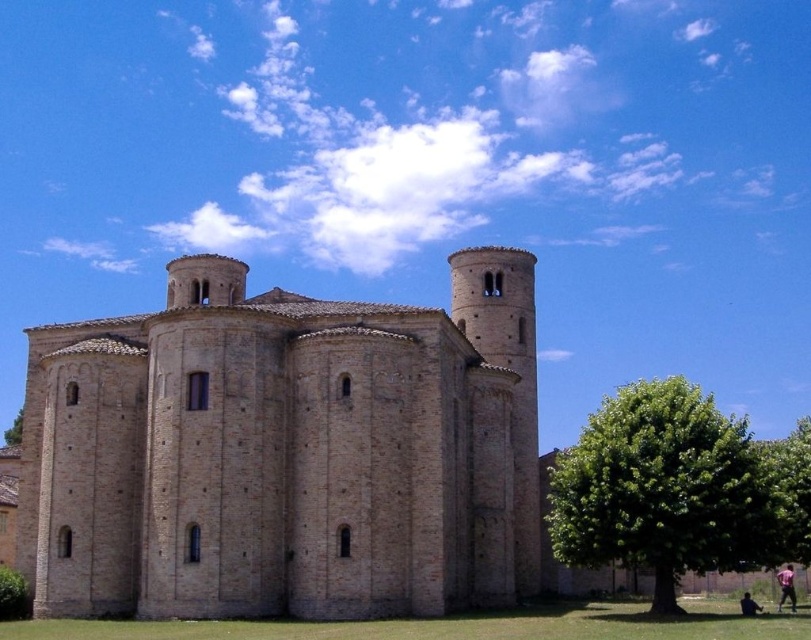
Question: Is beige stone church at center to the left of green leafy tree at lower right from the viewer's perspective?

Choices:
 (A) no
 (B) yes

Answer: (B)

Question: Which point appears farthest from the camera in this image?

Choices:
 (A) (792, 596)
 (B) (11, 433)

Answer: (B)

Question: Among these points, which one is farthest from the camera?

Choices:
 (A) (792, 589)
 (B) (747, 608)
 (C) (792, 547)

Answer: (A)

Question: Can you confirm if green leafy tree at lower right is positioned above green leafy tree at lower left?

Choices:
 (A) no
 (B) yes

Answer: (B)

Question: Which object is the closest to the green leafy tree at lower right?

Choices:
 (A) green leafy tree at lower left
 (B) pink fabric pants at lower right

Answer: (B)

Question: Does pink fabric pants at lower right have a smaller size compared to skinny jeans at lower right?

Choices:
 (A) no
 (B) yes

Answer: (B)